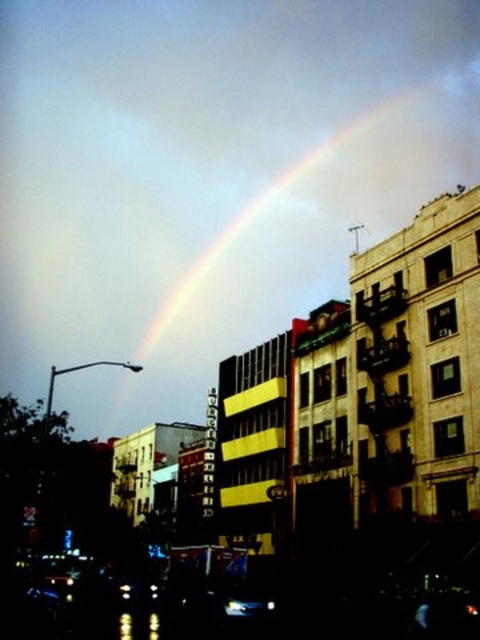
Question: Is rainbow at upper center smaller than shiny silver car at lower center?

Choices:
 (A) no
 (B) yes

Answer: (A)

Question: From the image, what is the correct spatial relationship of rainbow at upper center in relation to shiny silver car at lower center?

Choices:
 (A) right
 (B) left

Answer: (A)

Question: Considering the relative positions of rainbow at upper center and shiny silver car at lower center in the image provided, where is rainbow at upper center located with respect to shiny silver car at lower center?

Choices:
 (A) below
 (B) above

Answer: (B)

Question: Which point is farther to the camera?

Choices:
 (A) (383, 198)
 (B) (267, 600)

Answer: (A)